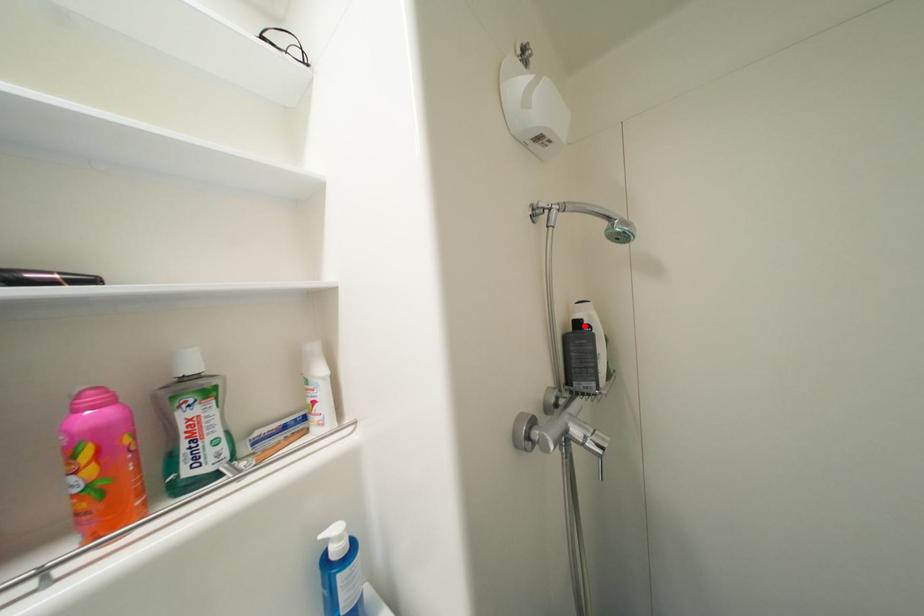
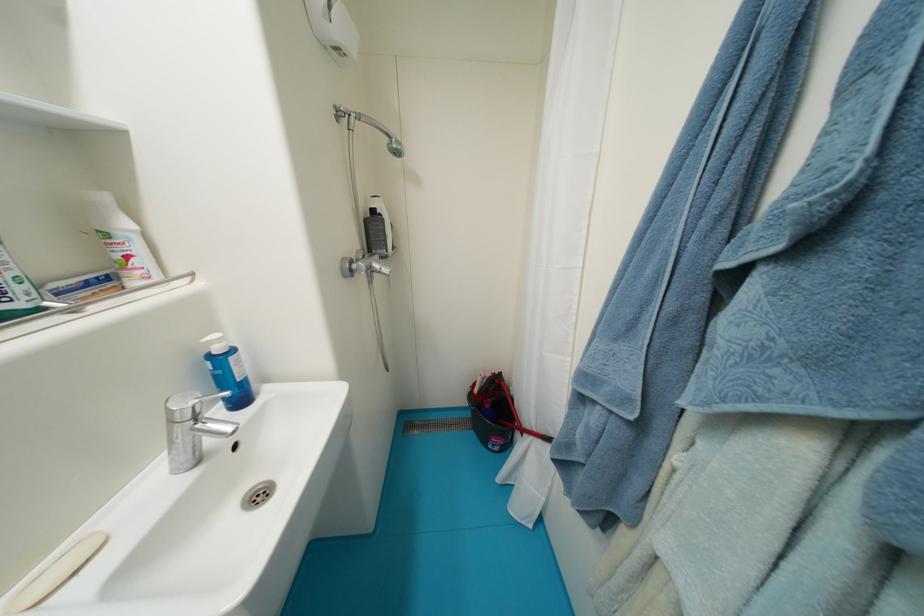
The point at the highlighted location is marked in the first image. Where is the corresponding point in the second image?

(380, 214)